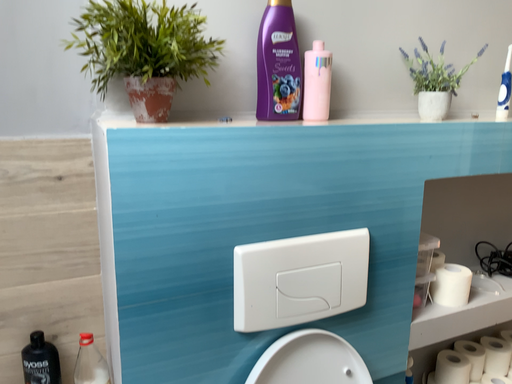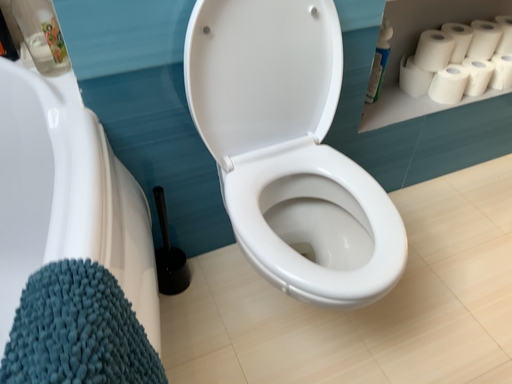
Question: Which way did the camera rotate in the video?

Choices:
 (A) rotated downward
 (B) rotated upward

Answer: (A)